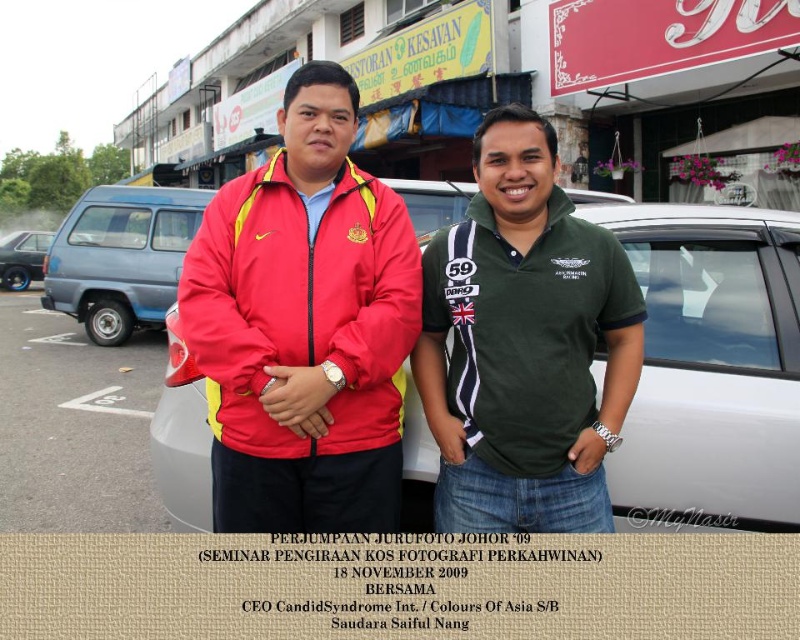
Which of these two, green cotton polo shirt at center or blue metallic sedan at left, stands shorter?

blue metallic sedan at left

Locate an element on the screen. This screenshot has width=800, height=640. green cotton polo shirt at center is located at coordinates (524, 344).

What are the coordinates of `green cotton polo shirt at center` in the screenshot? It's located at (524, 344).

Which is behind, point (590, 266) or point (634, 244)?

The point (634, 244) is more distant.

Image resolution: width=800 pixels, height=640 pixels. In order to click on green cotton polo shirt at center in this screenshot , I will do `click(524, 344)`.

Is matte nylon jacket at center further to the viewer compared to green cotton polo shirt at center?

That is False.

Is matte nylon jacket at center to the left of green cotton polo shirt at center from the viewer's perspective?

Correct, you'll find matte nylon jacket at center to the left of green cotton polo shirt at center.

Is point (384, 280) positioned before point (490, 312)?

No, (384, 280) is further to viewer.

The width and height of the screenshot is (800, 640). Identify the location of matte nylon jacket at center. (304, 326).